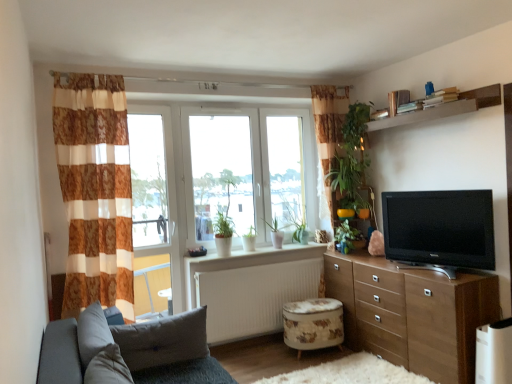
Question: Is green matte plant at center, which is the 2th plant from front to back, taller or shorter than transparent glass window at center?

Choices:
 (A) tall
 (B) short

Answer: (B)

Question: From the image's perspective, is green matte plant at center, which is the first plant from back to front, positioned above or below transparent glass window at center?

Choices:
 (A) below
 (B) above

Answer: (A)

Question: Which object is the farthest from the gray fabric pillow at lower left?

Choices:
 (A) brown/white striped curtain at left
 (B) white plastic air purifier at lower right
 (C) white matte radiator at center
 (D) white plastic window frame at left
 (E) black glossy tv at right

Answer: (B)

Question: Which object is positioned farthest from the brown wooden shelf at upper right?

Choices:
 (A) white ceramic pots at center
 (B) gray fabric pillow at lower left
 (C) wooden chest of drawers at right
 (D) green matte plant at center, acting as the second plant starting from the right
 (E) white matte radiator at center

Answer: (B)